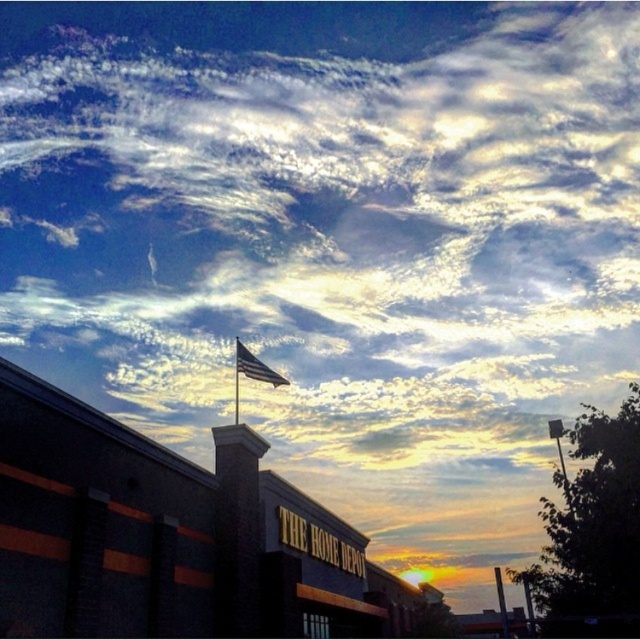
Between american flag at center and metallic flag pole at upper center, which one has less height?

american flag at center is shorter.

Can you confirm if american flag at center is positioned to the right of metallic flag pole at upper center?

Indeed, american flag at center is positioned on the right side of metallic flag pole at upper center.

Measure the distance between point (236, 349) and camera.

Point (236, 349) and camera are 70.56 meters apart.

This screenshot has height=640, width=640. In order to click on american flag at center in this screenshot , I will do `click(256, 365)`.

Which is below, metallic pole at right or metallic flag pole at upper center?

metallic pole at right

Is metallic pole at right bigger than metallic flag pole at upper center?

Yes, metallic pole at right is bigger than metallic flag pole at upper center.

This screenshot has width=640, height=640. Identify the location of metallic pole at right. (500, 602).

Can you confirm if american flag at center is smaller than metallic pole at right?

Yes, american flag at center is smaller than metallic pole at right.

This screenshot has width=640, height=640. What do you see at coordinates (256, 365) in the screenshot?
I see `american flag at center` at bounding box center [256, 365].

Locate an element on the screen. The image size is (640, 640). american flag at center is located at coordinates (256, 365).

Identify the location of american flag at center. (256, 365).